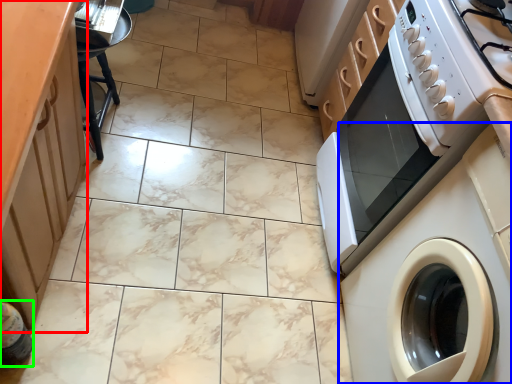
Question: Estimate the real-world distances between objects in this image. Which object is closer to cabinetry (highlighted by a red box), washing machine (highlighted by a blue box) or bottle (highlighted by a green box)?

Choices:
 (A) washing machine
 (B) bottle

Answer: (B)